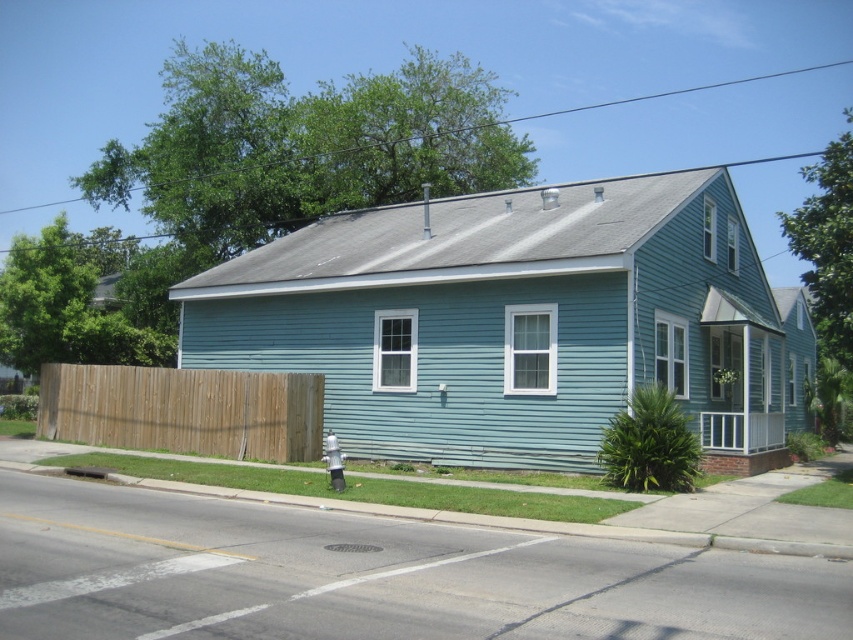
Is brown wooden fence at lower left taller than gray concrete curb at lower center?

Yes, brown wooden fence at lower left is taller than gray concrete curb at lower center.

Between brown wooden fence at lower left and gray concrete curb at lower center, which one is positioned lower?

gray concrete curb at lower center is lower down.

At what (x,y) coordinates should I click in order to perform the action: click on brown wooden fence at lower left. Please return your answer as a coordinate pair (x, y). Looking at the image, I should click on (183, 410).

Find the location of a particular element. Image resolution: width=853 pixels, height=640 pixels. brown wooden fence at lower left is located at coordinates (183, 410).